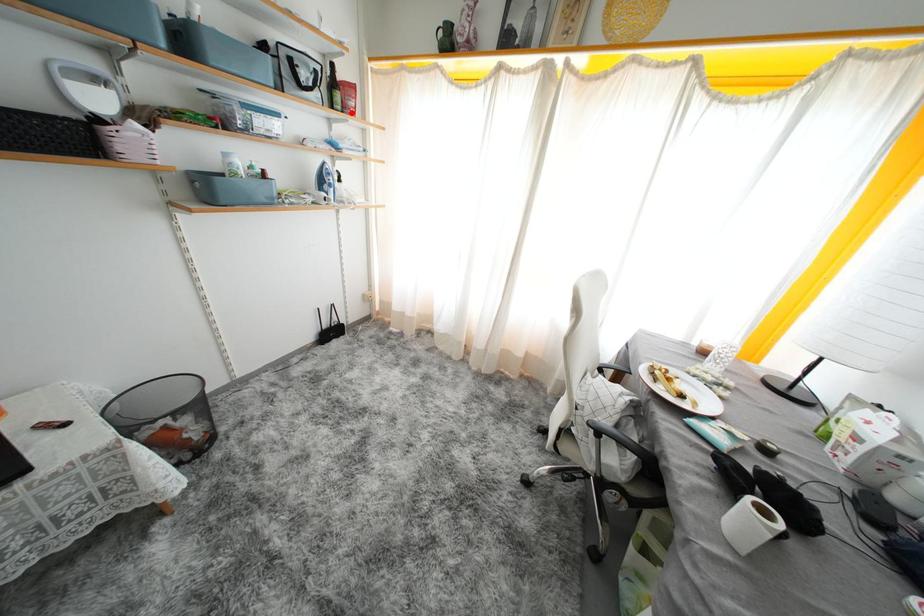
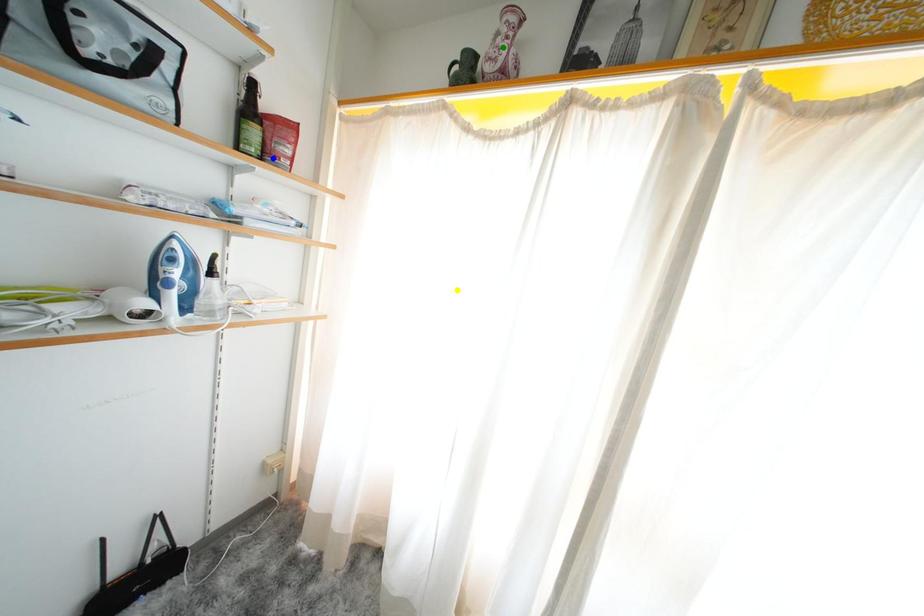
Question: I am providing you with two images of the same scene from different viewpoints. A red point is marked on the first image. You are given multiple points on the second image. Which point in image 2 represents the same 3d spot as the red point in image 1?

Choices:
 (A) yellow point
 (B) blue point
 (C) green point

Answer: (B)